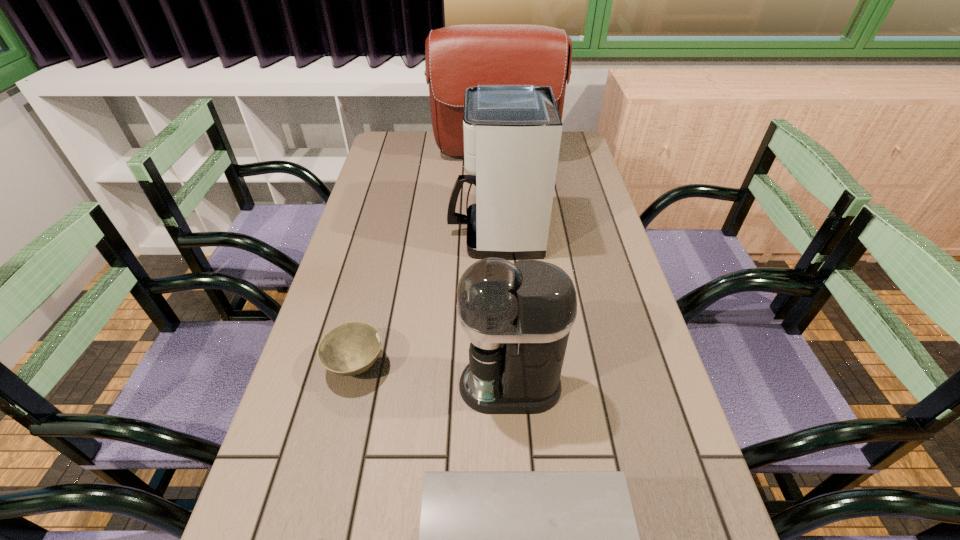
At what (x,y) coordinates should I click in order to perform the action: click on the farthest object. Please return your answer as a coordinate pair (x, y). Looking at the image, I should click on (457, 57).

You are a GUI agent. You are given a task and a screenshot of the screen. Output one action in this format:
    pyautogui.click(x=<x>, y=<y>)
    Task: Click on the farthest coffee maker
    
    Given the screenshot: What is the action you would take?
    pyautogui.click(x=512, y=133)

Locate an element on the screen. the second farthest object is located at coordinates (512, 133).

Identify the location of the second shortest coffee maker. The image size is (960, 540). (518, 316).

You are a GUI agent. You are given a task and a screenshot of the screen. Output one action in this format:
    pyautogui.click(x=<x>, y=<y>)
    Task: Click on the third tallest object
    This screenshot has width=960, height=540.
    Given the screenshot: What is the action you would take?
    pyautogui.click(x=518, y=316)

Identify the location of bowl. (351, 348).

Where is `the leftmost object`? The height and width of the screenshot is (540, 960). the leftmost object is located at coordinates (351, 348).

At what (x,y) coordinates should I click in order to perform the action: click on vacant space located on the open flap of the satchel. Please return your answer as a coordinate pair (x, y). Looking at the image, I should click on (499, 232).

The image size is (960, 540). I want to click on free space located on the front panel of the tallest coffee maker, so click(425, 235).

Identify the location of free location located 0.060m on the front panel of the tallest coffee maker. The width and height of the screenshot is (960, 540). (428, 235).